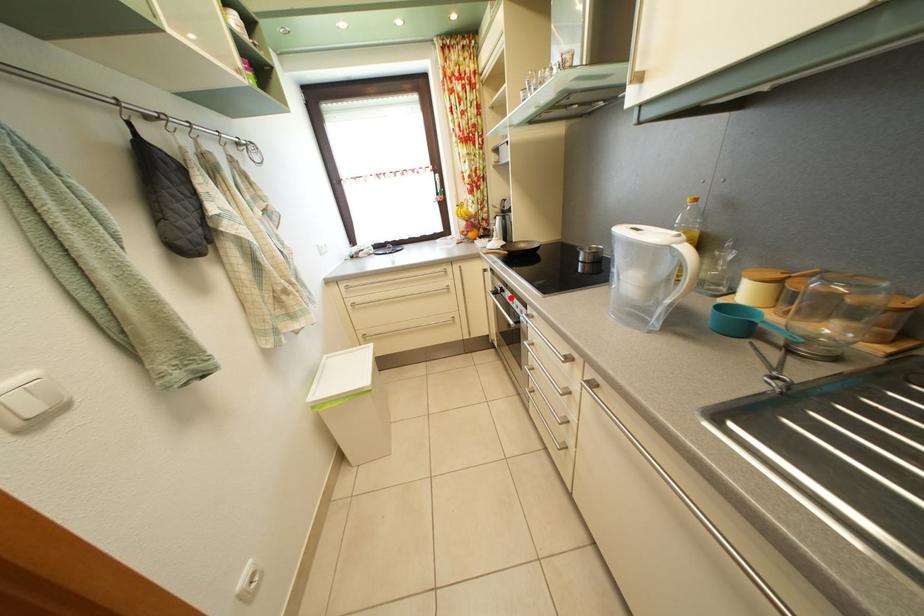
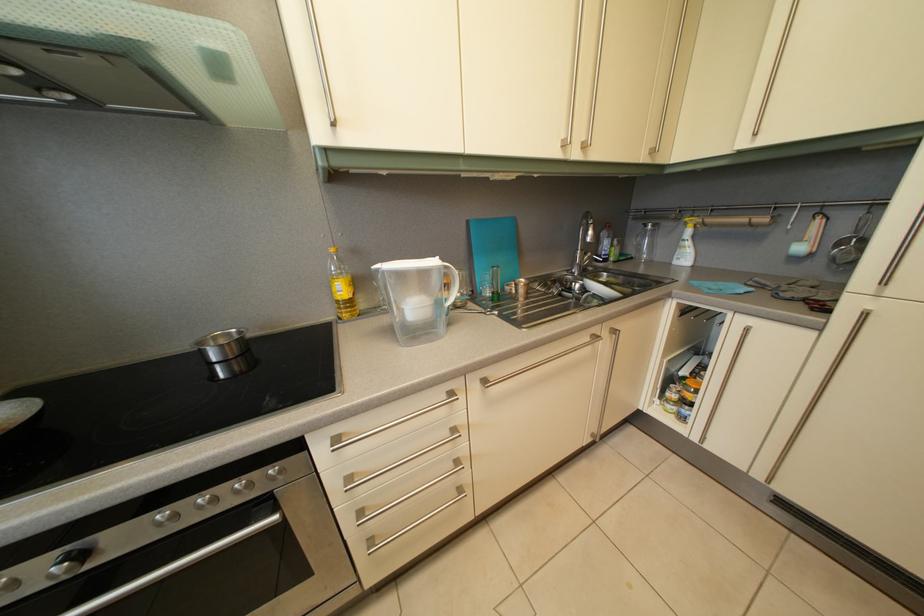
Find the pixel in the second image that matches the highlighted location in the first image.

(92, 562)